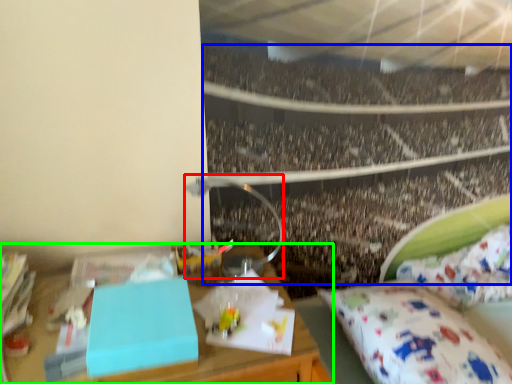
Question: Which object is the closest to the lamp (highlighted by a red box)? Choose among these: crowd (highlighted by a blue box) or desk (highlighted by a green box).

Choices:
 (A) crowd
 (B) desk

Answer: (B)